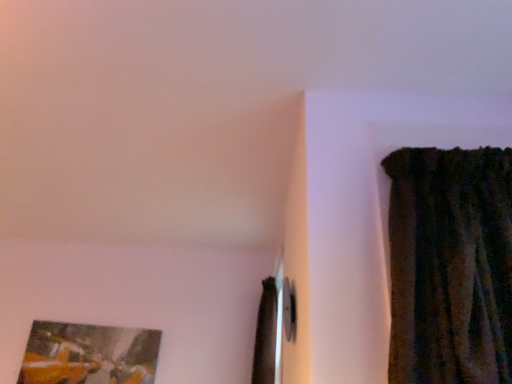
Question: Is matte wooden picture frame at lower left next to brown velvet curtain at center?

Choices:
 (A) no
 (B) yes

Answer: (A)

Question: Is matte wooden picture frame at lower left oriented towards brown velvet curtain at center?

Choices:
 (A) yes
 (B) no

Answer: (B)

Question: Are matte wooden picture frame at lower left and brown velvet curtain at center located far from each other?

Choices:
 (A) yes
 (B) no

Answer: (A)

Question: Is matte wooden picture frame at lower left positioned before brown velvet curtain at center?

Choices:
 (A) yes
 (B) no

Answer: (B)

Question: Considering the relative sizes of matte wooden picture frame at lower left and brown velvet curtain at center in the image provided, is matte wooden picture frame at lower left bigger than brown velvet curtain at center?

Choices:
 (A) yes
 (B) no

Answer: (B)

Question: Does matte wooden picture frame at lower left have a greater width compared to brown velvet curtain at center?

Choices:
 (A) no
 (B) yes

Answer: (A)

Question: Is brown velvet curtain at center positioned with its back to matte wooden picture frame at lower left?

Choices:
 (A) no
 (B) yes

Answer: (A)

Question: From a real-world perspective, is brown velvet curtain at center below matte wooden picture frame at lower left?

Choices:
 (A) yes
 (B) no

Answer: (B)

Question: Does brown velvet curtain at center have a lesser height compared to matte wooden picture frame at lower left?

Choices:
 (A) no
 (B) yes

Answer: (A)

Question: Can you confirm if brown velvet curtain at center is bigger than matte wooden picture frame at lower left?

Choices:
 (A) no
 (B) yes

Answer: (B)

Question: Is brown velvet curtain at center not close to matte wooden picture frame at lower left?

Choices:
 (A) no
 (B) yes

Answer: (B)

Question: From a real-world perspective, is brown velvet curtain at center on matte wooden picture frame at lower left?

Choices:
 (A) yes
 (B) no

Answer: (A)

Question: Considering the positions of matte wooden picture frame at lower left and brown velvet curtain at center in the image, is matte wooden picture frame at lower left bigger or smaller than brown velvet curtain at center?

Choices:
 (A) small
 (B) big

Answer: (A)